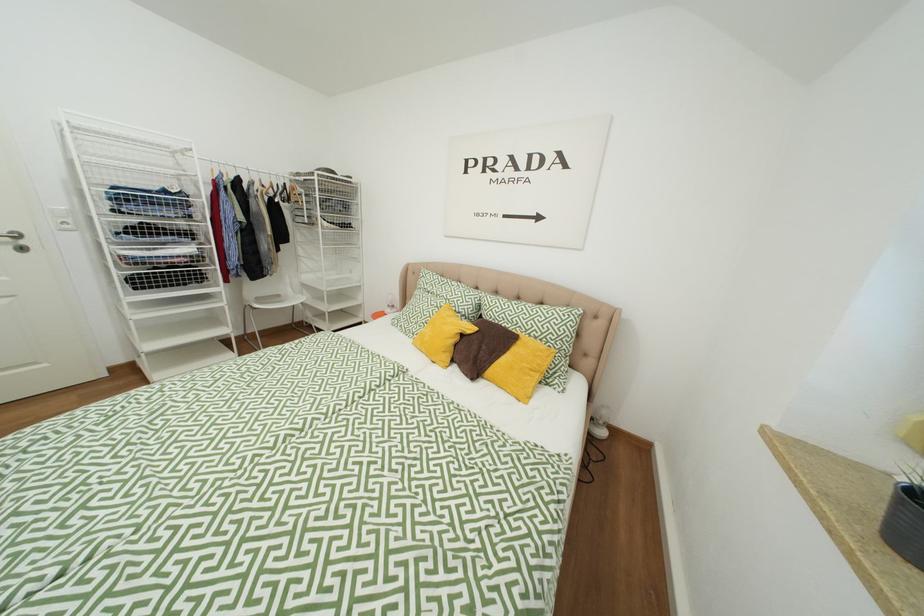
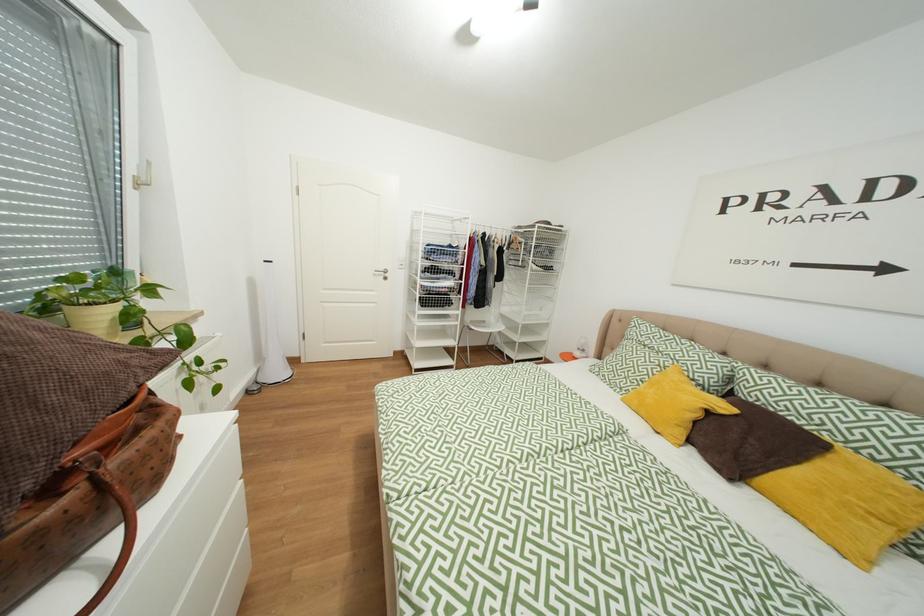
Question: The camera is either moving clockwise (left) or counter-clockwise (right) around the object. The first image is from the beginning of the video and the second image is from the end. Is the camera moving left or right when shooting the video?

Choices:
 (A) Left
 (B) Right

Answer: (B)